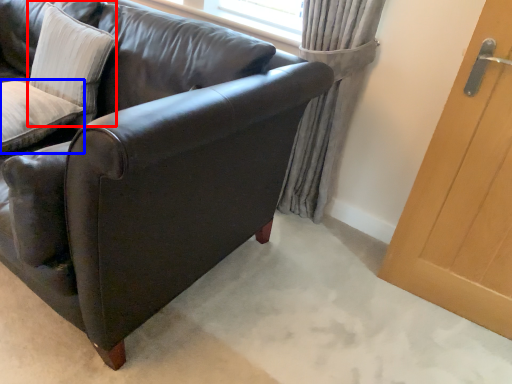
Question: Which point is further to the camera, pillow (highlighted by a red box) or pillow (highlighted by a blue box)?

Choices:
 (A) pillow
 (B) pillow

Answer: (A)